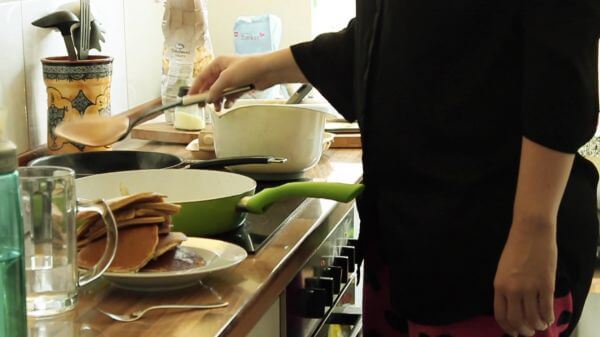
Where is `mug`? The image size is (600, 337). mug is located at coordinates (64, 228).